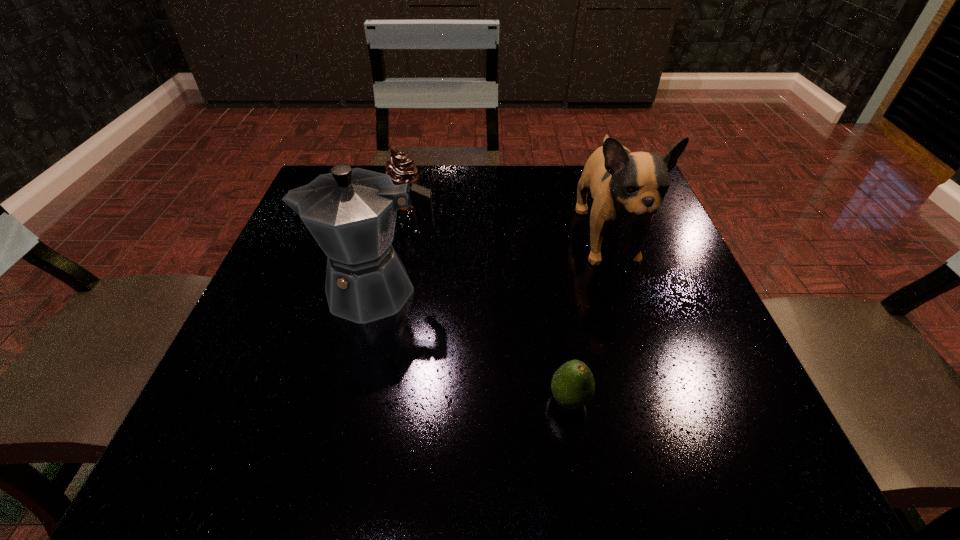
Locate an element on the screen. puppy is located at coordinates (627, 188).

The height and width of the screenshot is (540, 960). I want to click on coffeepot, so click(x=351, y=213).

The width and height of the screenshot is (960, 540). Find the location of `icecream`. icecream is located at coordinates (401, 169).

This screenshot has height=540, width=960. I want to click on avocado, so click(x=573, y=386).

I want to click on the third object from left to right, so [x=573, y=386].

Find the location of `vacant space situated at the face of the rightmost object`. vacant space situated at the face of the rightmost object is located at coordinates (681, 464).

This screenshot has height=540, width=960. I want to click on vacant area located 0.080m at the spout of the coffeepot, so click(x=273, y=290).

The height and width of the screenshot is (540, 960). What are the coordinates of `free region located 0.050m at the spout of the coffeepot` in the screenshot? It's located at (288, 290).

Identify the location of free location located at the spout of the coffeepot. Image resolution: width=960 pixels, height=540 pixels. (262, 290).

The height and width of the screenshot is (540, 960). Identify the location of vacant space located on the front of the second shortest object. (400, 234).